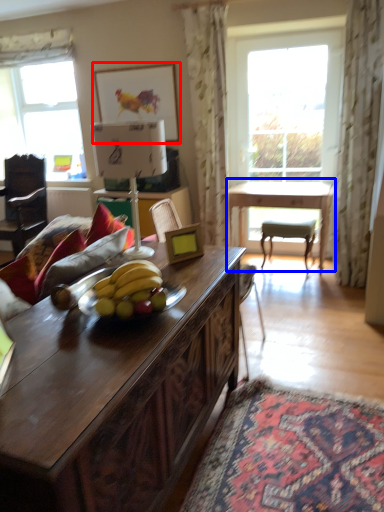
Question: Which object is closer to the camera taking this photo, picture frame (highlighted by a red box) or table (highlighted by a blue box)?

Choices:
 (A) picture frame
 (B) table

Answer: (B)